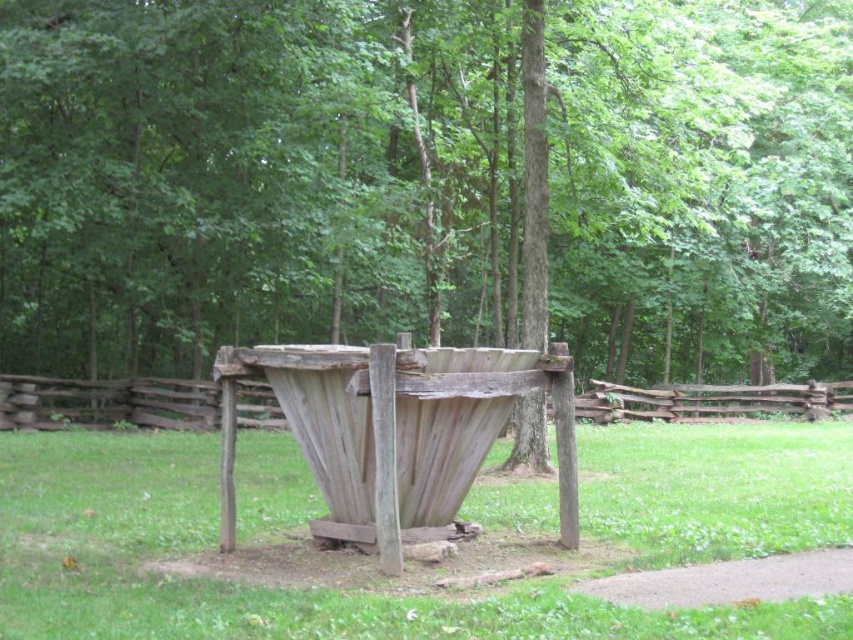
You are standing at the point closer to the wooden structure in the scene. There are two points marked in the image, one at coordinates point (134, 26) and the other at point (674, 548). Which point is farther away from you?

Point (674, 548) is farther away from you because the point (134, 26) is behind point (674, 548), meaning it is closer to you.